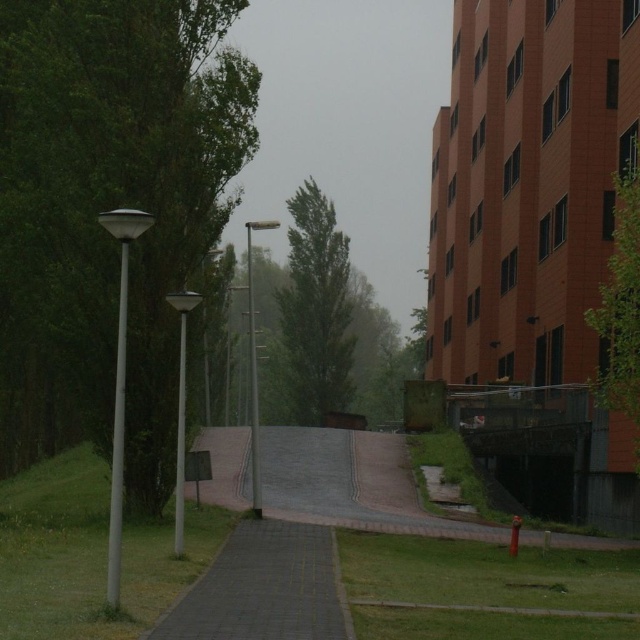
Question: Which of the following is the farthest from the observer?

Choices:
 (A) green leafy tree at left
 (B) paved stone path at center
 (C) green leafy tree at center
 (D) green leafy tree at upper right

Answer: (C)

Question: Among these objects, which one is farthest from the camera?

Choices:
 (A) green leafy tree at left
 (B) green leafy tree at center
 (C) green leafy tree at upper right
 (D) paved stone path at center

Answer: (B)

Question: Which of the following is the closest to the observer?

Choices:
 (A) paved stone path at center
 (B) green leafy tree at upper right

Answer: (A)

Question: Is the position of green leafy tree at left more distant than that of green leafy tree at center?

Choices:
 (A) no
 (B) yes

Answer: (A)

Question: Is green leafy tree at left wider than green leafy tree at upper right?

Choices:
 (A) yes
 (B) no

Answer: (A)

Question: Is paved stone path at center positioned before green leafy tree at center?

Choices:
 (A) yes
 (B) no

Answer: (A)